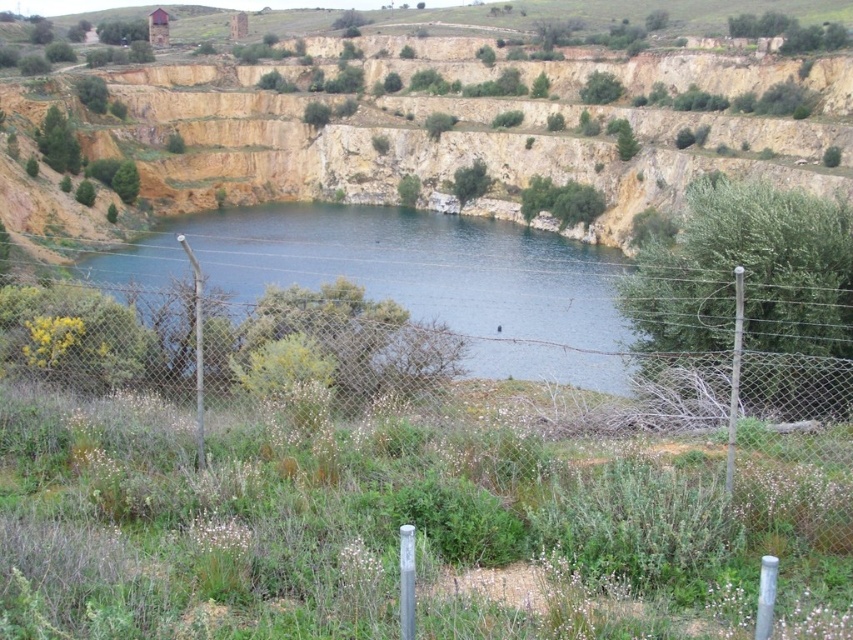
How distant is yellowish rock at center from wire mesh fence at center?

107.17 meters

Which is above, yellowish rock at center or wire mesh fence at center?

yellowish rock at center is higher up.

You are a GUI agent. You are given a task and a screenshot of the screen. Output one action in this format:
    pyautogui.click(x=<x>, y=<y>)
    Task: Click on the yellowish rock at center
    The width and height of the screenshot is (853, 640).
    Given the screenshot: What is the action you would take?
    pyautogui.click(x=468, y=125)